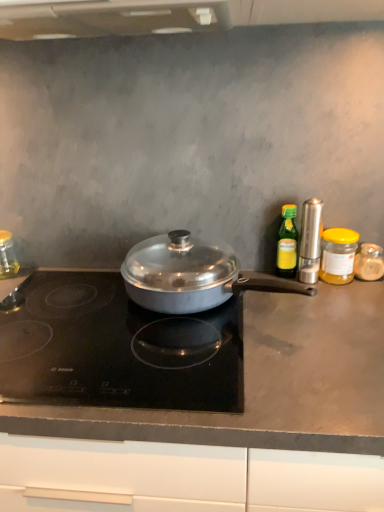
Locate an element on the screen. The height and width of the screenshot is (512, 384). free location in front of satin silver pepper mill at right, the 4th kitchen appliance positioned from the left is located at coordinates (321, 313).